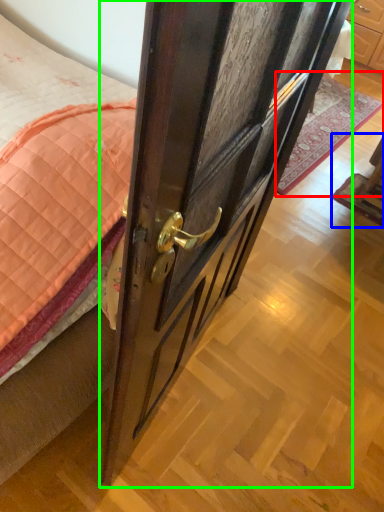
Question: Which object is the farthest from plain (highlighted by a red box)? Choose among these: furniture (highlighted by a blue box) or door (highlighted by a green box).

Choices:
 (A) furniture
 (B) door

Answer: (B)